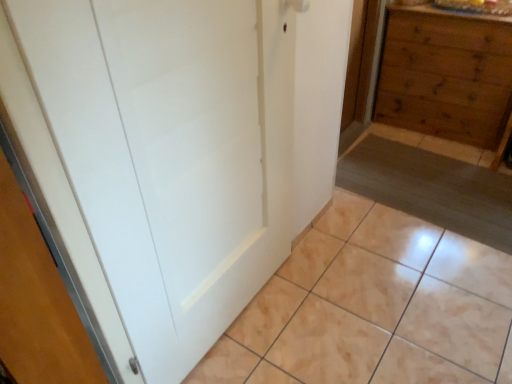
Question: Does beige glossy tile at lower center have a smaller size compared to white matte door at center?

Choices:
 (A) yes
 (B) no

Answer: (B)

Question: Does beige glossy tile at lower center have a larger size compared to white matte door at center?

Choices:
 (A) no
 (B) yes

Answer: (B)

Question: Is beige glossy tile at lower center placed right next to white matte door at center?

Choices:
 (A) no
 (B) yes

Answer: (A)

Question: Considering the relative positions of beige glossy tile at lower center and white matte door at center in the image provided, is beige glossy tile at lower center to the left of white matte door at center from the viewer's perspective?

Choices:
 (A) no
 (B) yes

Answer: (A)

Question: Could you tell me if beige glossy tile at lower center is facing white matte door at center?

Choices:
 (A) no
 (B) yes

Answer: (A)

Question: Is beige glossy tile at lower center not inside white matte door at center?

Choices:
 (A) no
 (B) yes

Answer: (B)

Question: From a real-world perspective, is wooden chest of drawers at right on beige glossy tile at lower center?

Choices:
 (A) no
 (B) yes

Answer: (B)

Question: Is wooden chest of drawers at right further to camera compared to beige glossy tile at lower center?

Choices:
 (A) yes
 (B) no

Answer: (A)

Question: Is wooden chest of drawers at right not within beige glossy tile at lower center?

Choices:
 (A) no
 (B) yes

Answer: (B)

Question: Is wooden chest of drawers at right shorter than beige glossy tile at lower center?

Choices:
 (A) yes
 (B) no

Answer: (B)

Question: Can you confirm if wooden chest of drawers at right is bigger than beige glossy tile at lower center?

Choices:
 (A) no
 (B) yes

Answer: (B)

Question: Considering the relative sizes of wooden chest of drawers at right and beige glossy tile at lower center in the image provided, is wooden chest of drawers at right taller than beige glossy tile at lower center?

Choices:
 (A) no
 (B) yes

Answer: (B)

Question: Is beige glossy tile at lower center facing towards wooden chest of drawers at right?

Choices:
 (A) yes
 (B) no

Answer: (B)